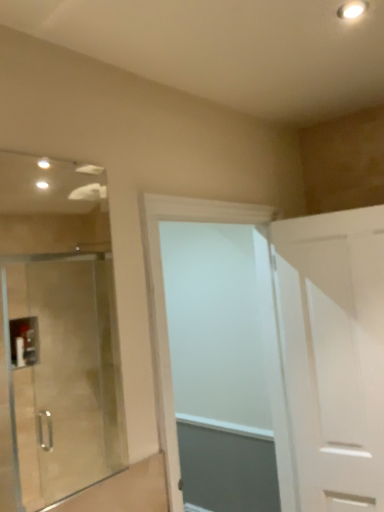
Question: From a real-world perspective, relative to white matte door at center, marked as the 2th door in a right-to-left arrangement, is white matte door at right, marked as the second door in a left-to-right arrangement, vertically above or below?

Choices:
 (A) above
 (B) below

Answer: (B)

Question: Is point (299, 382) positioned closer to the camera than point (167, 199)?

Choices:
 (A) closer
 (B) farther

Answer: (B)

Question: In terms of size, does white matte door at right, which is the 1th door from right to left, appear bigger or smaller than white matte door at center, which is the first door in left-to-right order?

Choices:
 (A) small
 (B) big

Answer: (A)

Question: Is point (168, 415) positioned closer to the camera than point (307, 414)?

Choices:
 (A) closer
 (B) farther

Answer: (A)

Question: Is white matte door at center, marked as the 2th door in a right-to-left arrangement, taller or shorter than white matte door at right, which is the 1th door from right to left?

Choices:
 (A) short
 (B) tall

Answer: (B)

Question: Considering the relative positions of white matte door at center, which is the first door in left-to-right order, and white matte door at right, marked as the second door in a left-to-right arrangement, in the image provided, is white matte door at center, which is the first door in left-to-right order, to the left or to the right of white matte door at right, marked as the second door in a left-to-right arrangement,?

Choices:
 (A) right
 (B) left

Answer: (B)

Question: Looking at their shapes, would you say white matte door at center, which is the first door in left-to-right order, is wider or thinner than white matte door at right, marked as the second door in a left-to-right arrangement?

Choices:
 (A) thin
 (B) wide

Answer: (B)